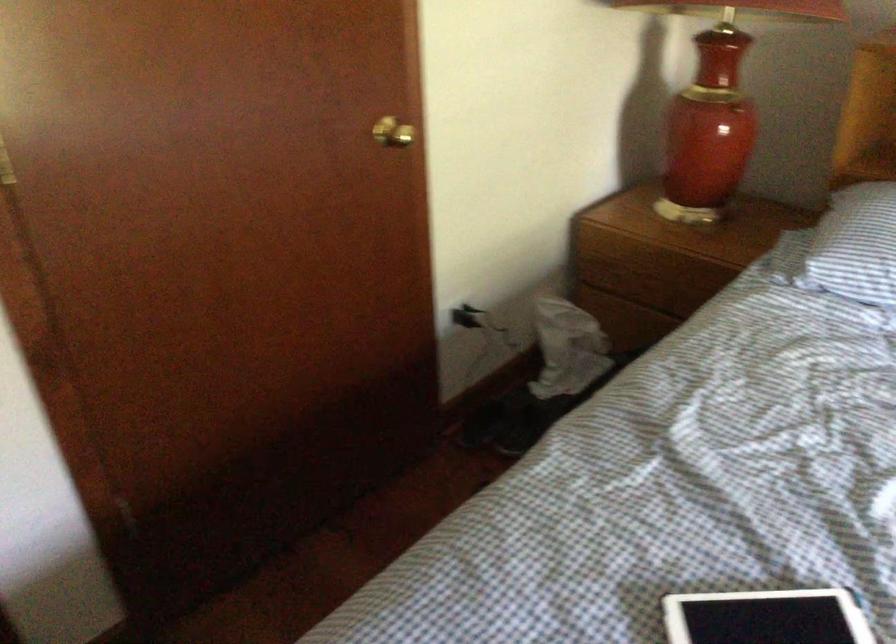
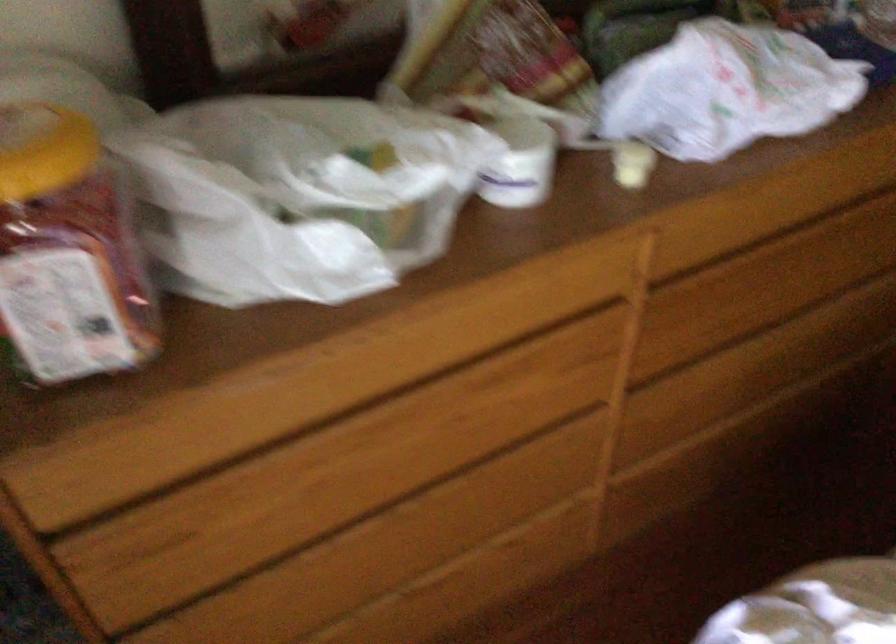
The first image is from the beginning of the video and the second image is from the end. How did the camera likely rotate when shooting the video?

The rotation direction of the camera is left-down.